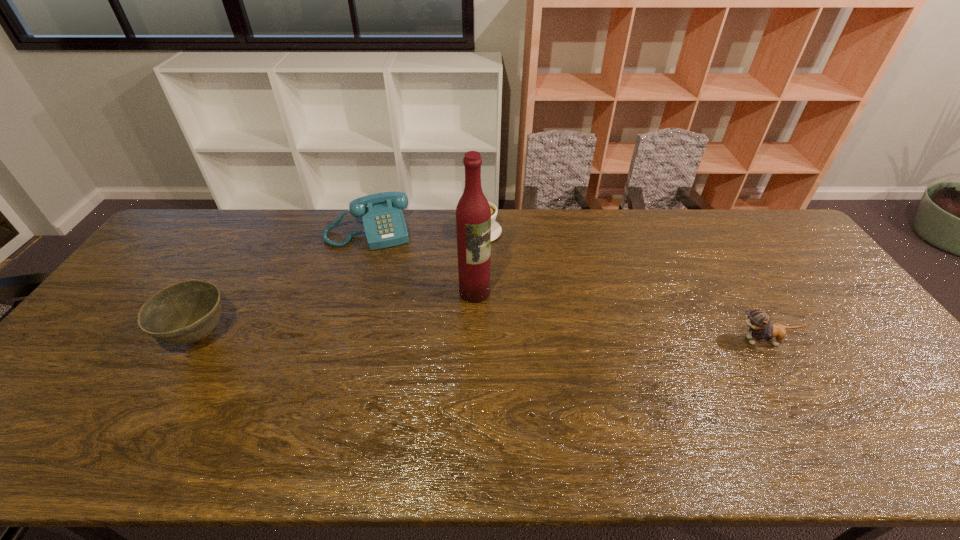
I want to click on free area in between the rightmost object and the shortest object, so click(x=622, y=287).

The image size is (960, 540). In order to click on free space between the fourth object from right to left and the rightmost object in this screenshot , I will do `click(566, 286)`.

Identify the location of free space between the cappuccino and the second object from left to right. point(424,231).

Identify the location of vacant space that's between the liquor and the fourth object from right to left. (421, 261).

The width and height of the screenshot is (960, 540). In order to click on free space between the kitten and the second object from left to right in this screenshot , I will do `click(566, 286)`.

The width and height of the screenshot is (960, 540). I want to click on object identified as the closest to the third farthest object, so click(496, 230).

Identify the location of the second closest object to the rightmost object. click(x=496, y=230).

The height and width of the screenshot is (540, 960). I want to click on free space that satisfies the following two spatial constraints: 1. on the front side of the second object from left to right; 2. on the right side of the liquor, so 349,292.

Identify the location of blank space that satisfies the following two spatial constraints: 1. on the front side of the second object from left to right; 2. on the front-facing side of the kitten. (335, 341).

Identify the location of free space that satisfies the following two spatial constraints: 1. on the back side of the leftmost object; 2. on the left side of the tallest object. The height and width of the screenshot is (540, 960). 225,292.